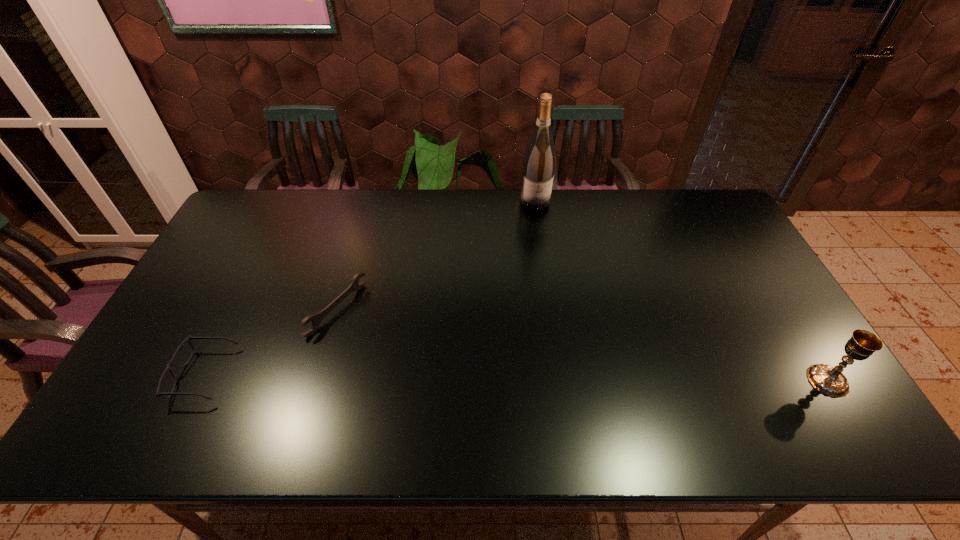
What are the coordinates of `vacant area situated 0.170m on the label of the farthest object` in the screenshot? It's located at (544, 242).

Where is `vacant space located on the label of the farthest object`? Image resolution: width=960 pixels, height=540 pixels. vacant space located on the label of the farthest object is located at coordinates (555, 289).

This screenshot has width=960, height=540. In order to click on vacant region located 0.090m on the open ends of the second object from left to right in this screenshot , I will do `click(379, 340)`.

At what (x,y) coordinates should I click in order to perform the action: click on free location located 0.230m on the open ends of the second object from left to right. Please return your answer as a coordinate pair (x, y). Looking at the image, I should click on (421, 363).

This screenshot has width=960, height=540. In order to click on free point located on the open ends of the second object from left to right in this screenshot , I will do `click(396, 349)`.

At what (x,y) coordinates should I click in order to perform the action: click on object situated at the far edge. Please return your answer as a coordinate pair (x, y). Image resolution: width=960 pixels, height=540 pixels. Looking at the image, I should click on (538, 168).

You are a GUI agent. You are given a task and a screenshot of the screen. Output one action in this format:
    pyautogui.click(x=<x>, y=<y>)
    Task: Click on the spectacles at the near edge
    Image resolution: width=960 pixels, height=540 pixels.
    Given the screenshot: What is the action you would take?
    pyautogui.click(x=158, y=393)

Identify the location of chalice that is at the near edge. The height and width of the screenshot is (540, 960). (829, 380).

Find the location of `object positioned at the left edge`. object positioned at the left edge is located at coordinates (158, 393).

Locate an element on the screen. object present at the right edge is located at coordinates (829, 380).